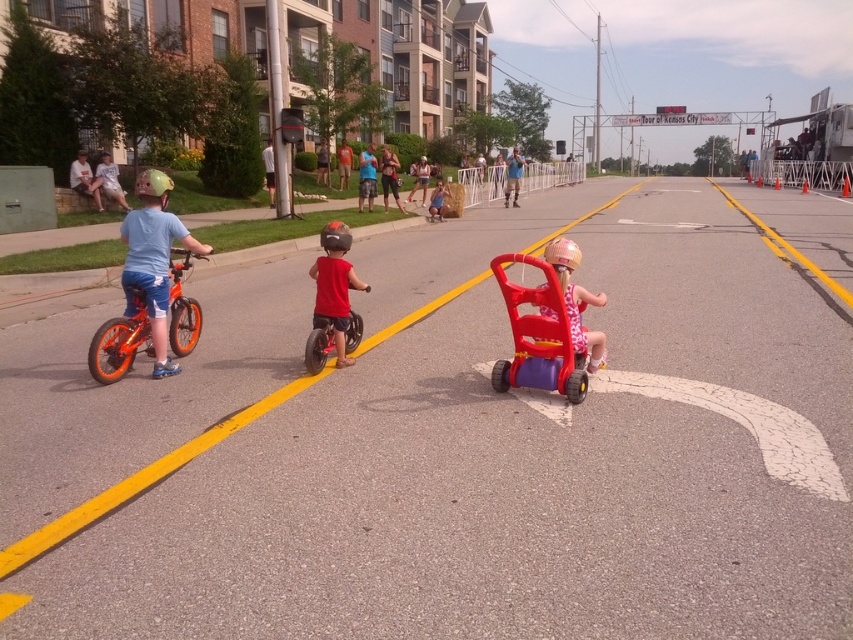
Question: Which point is closer to the camera?

Choices:
 (A) rubberized plastic baby carriage at center
 (B) metallic silver bicycle at center
 (C) orange matte bicycle at left
 (D) matte pink tricycle at center

Answer: (A)

Question: Can you confirm if rubberized plastic baby carriage at center is positioned to the right of orange matte bicycle at left?

Choices:
 (A) no
 (B) yes

Answer: (B)

Question: Is rubberized plastic baby carriage at center smaller than matte pink tricycle at center?

Choices:
 (A) no
 (B) yes

Answer: (A)

Question: Which point appears farthest from the camera in this image?

Choices:
 (A) (563, 317)
 (B) (544, 248)

Answer: (B)

Question: Can you confirm if rubberized plastic baby carriage at center is wider than matte pink tricycle at center?

Choices:
 (A) yes
 (B) no

Answer: (A)

Question: Among these objects, which one is nearest to the camera?

Choices:
 (A) rubberized plastic baby carriage at center
 (B) matte pink tricycle at center
 (C) orange matte bicycle at left
 (D) metallic silver bicycle at center

Answer: (A)